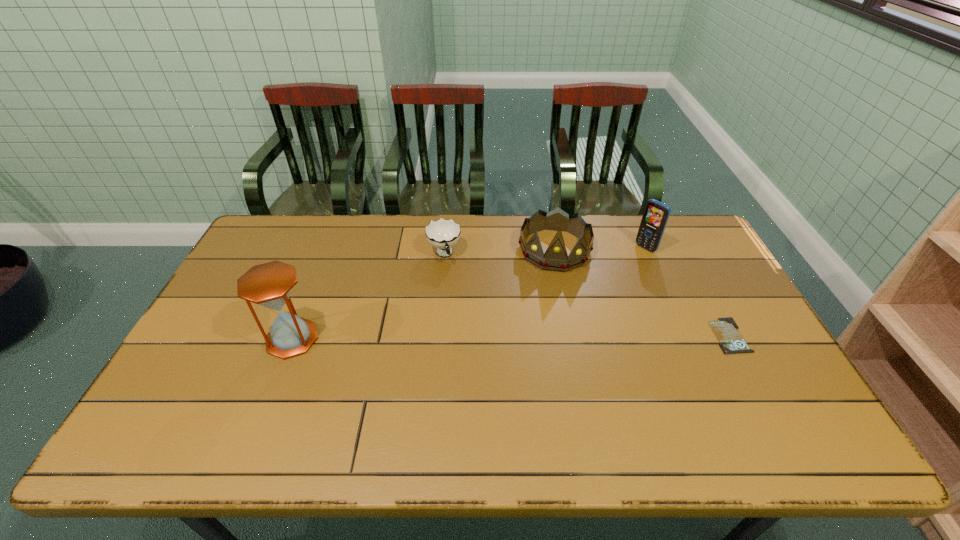
Where is `the tallest object`? the tallest object is located at coordinates (269, 285).

This screenshot has height=540, width=960. What are the coordinates of `the leftmost object` in the screenshot? It's located at (269, 285).

Where is `the shortest object`? The image size is (960, 540). the shortest object is located at coordinates (731, 341).

What are the coordinates of `identity card` in the screenshot? It's located at (731, 341).

This screenshot has height=540, width=960. In order to click on the third object from right to left in this screenshot , I will do `click(555, 258)`.

At what (x,y) coordinates should I click in order to perform the action: click on cup. Please return your answer as a coordinate pair (x, y). This screenshot has width=960, height=540. Looking at the image, I should click on (443, 234).

Locate an element on the screen. the second object from left to right is located at coordinates (443, 234).

Identify the location of the fourth object from left to right. (656, 214).

Where is `vacant space located on the left of the tallest object`? vacant space located on the left of the tallest object is located at coordinates (216, 339).

At what (x,y) coordinates should I click in order to perform the action: click on vacant space positioned 0.200m on the left of the rightmost object. Please return your answer as a coordinate pair (x, y). Image resolution: width=960 pixels, height=540 pixels. Looking at the image, I should click on tap(642, 335).